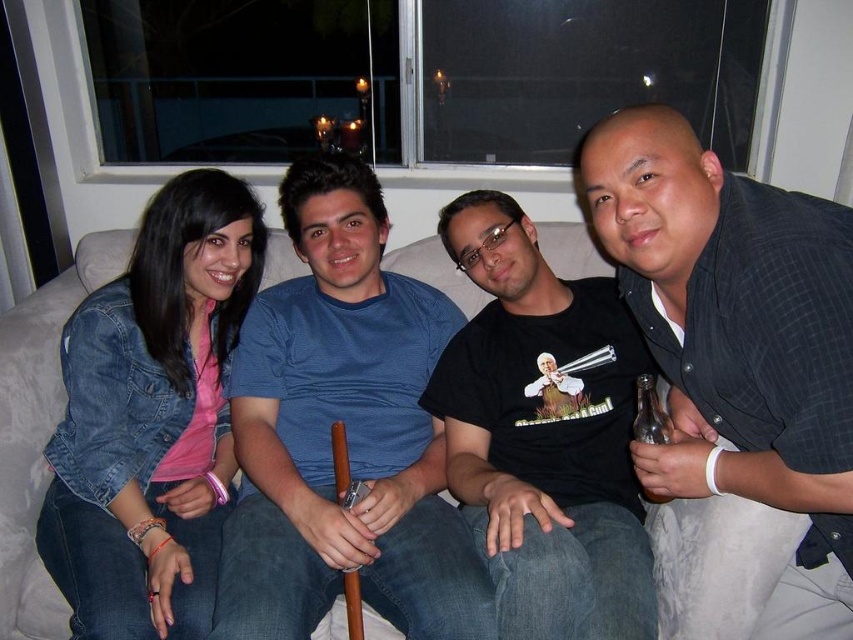
Does dark gray checkered shirt at right appear under white fabric couch at center?

No.

Does dark gray checkered shirt at right have a lesser width compared to white fabric couch at center?

Incorrect, dark gray checkered shirt at right's width is not less than white fabric couch at center's.

Is point (665, 212) in front of point (102, 253)?

Yes, point (665, 212) is in front of point (102, 253).

The image size is (853, 640). Find the location of `dark gray checkered shirt at right`. dark gray checkered shirt at right is located at coordinates (738, 342).

Which is in front, point (317, 536) or point (531, 413)?

Point (317, 536)

Does point (390, 376) lie behind point (448, 467)?

Yes.

The width and height of the screenshot is (853, 640). What do you see at coordinates (345, 433) in the screenshot? I see `blue cotton shirt at center` at bounding box center [345, 433].

The image size is (853, 640). I want to click on blue cotton shirt at center, so click(345, 433).

Can you confirm if blue cotton shirt at center is bigger than white fabric couch at center?

Correct, blue cotton shirt at center is larger in size than white fabric couch at center.

You are a GUI agent. You are given a task and a screenshot of the screen. Output one action in this format:
    pyautogui.click(x=<x>, y=<y>)
    Task: Click on the blue cotton shirt at center
    
    Given the screenshot: What is the action you would take?
    pyautogui.click(x=345, y=433)

Find the location of a particular element. blue cotton shirt at center is located at coordinates tap(345, 433).